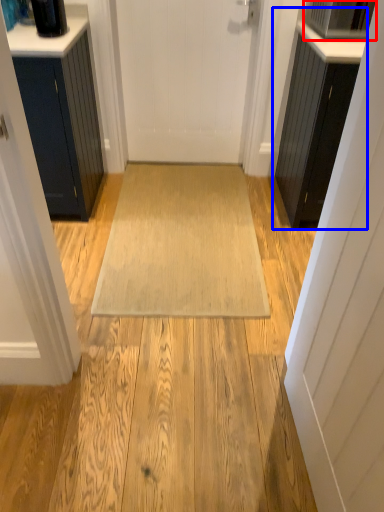
Question: Which object appears farthest to the camera in this image, appliance (highlighted by a red box) or cabinetry (highlighted by a blue box)?

Choices:
 (A) appliance
 (B) cabinetry

Answer: (A)